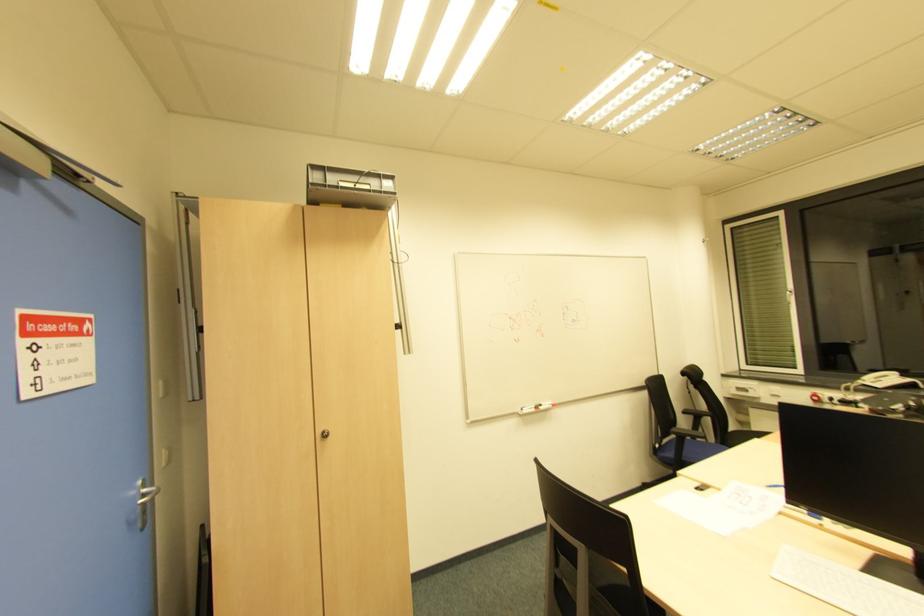
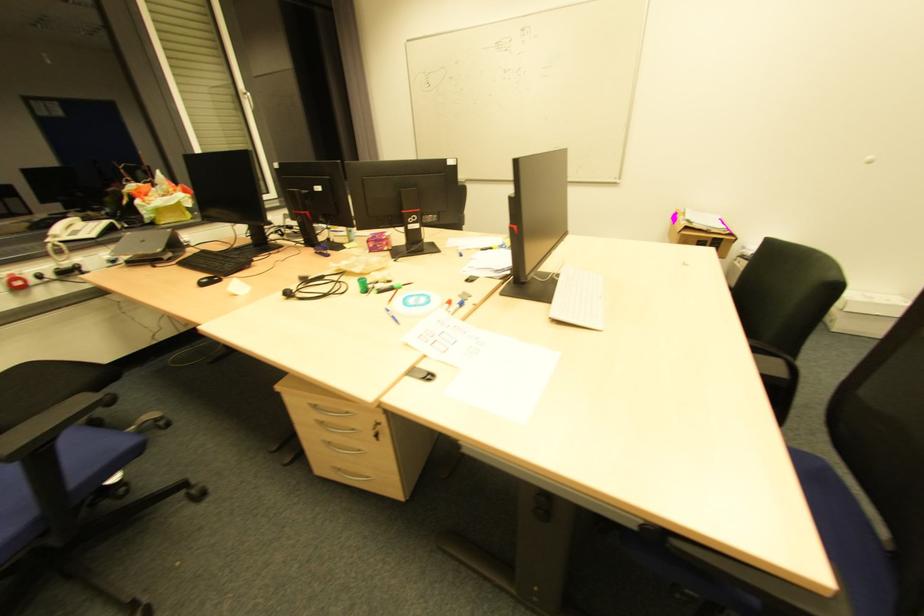
In the second image, find the point that corresponds to (880,387) in the first image.

(91, 237)